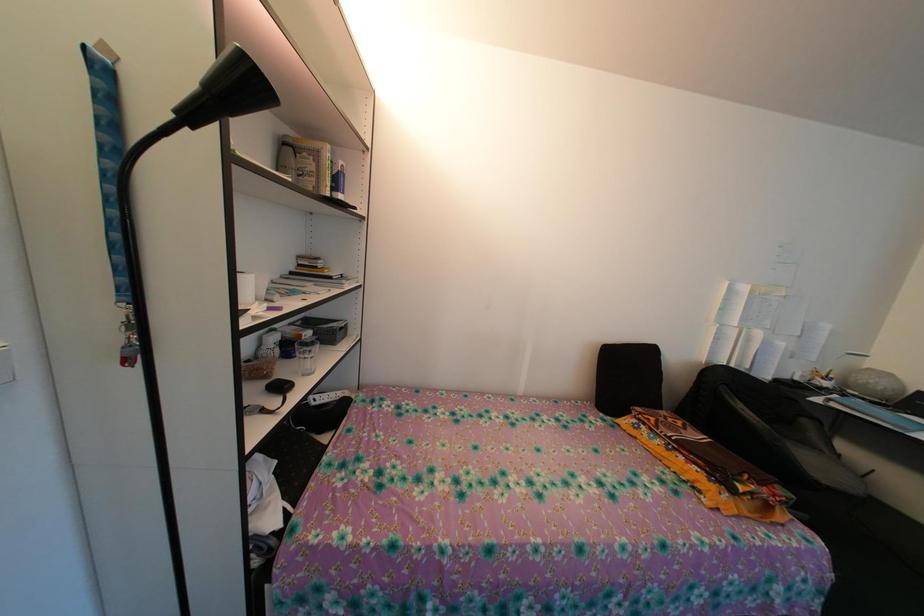
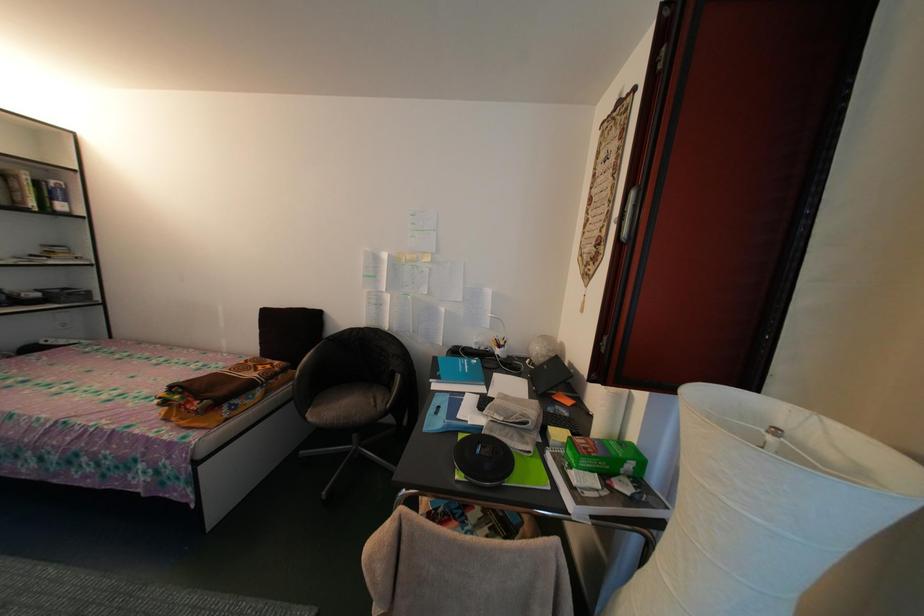
Question: What movement of the cameraman would produce the second image?

Choices:
 (A) Left
 (B) Right
 (C) Forward
 (D) Backward

Answer: (B)